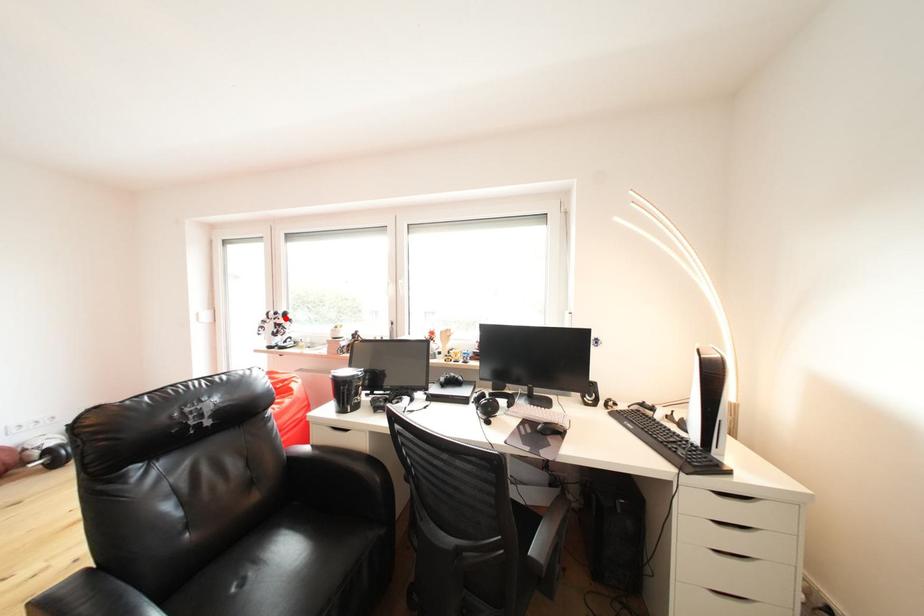
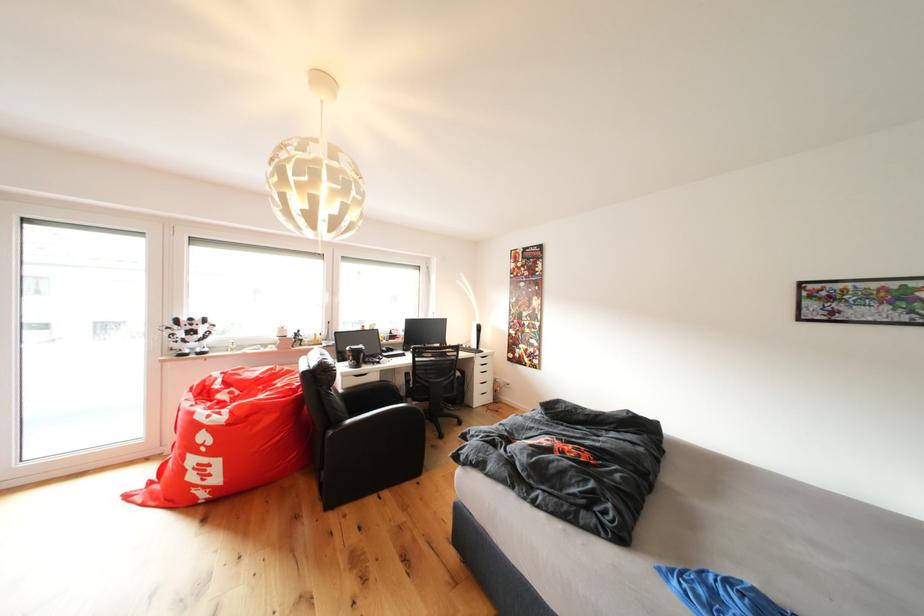
The point at the highlighted location is marked in the first image. Where is the corresponding point in the second image?

(200, 323)